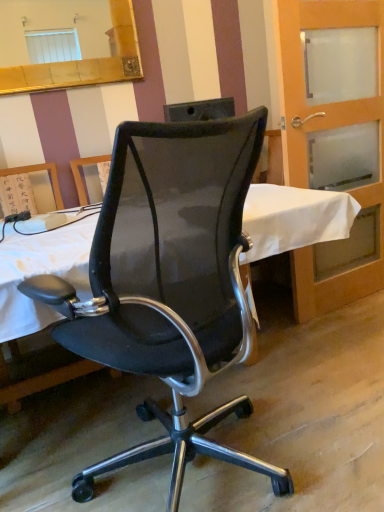
Measure the distance between point (370,83) and camera.

The depth of point (370,83) is 7.48 feet.

Describe the element at coordinates (334, 139) in the screenshot. I see `translucent glass door at right` at that location.

What do you see at coordinates (169, 282) in the screenshot?
I see `black mesh office chair at center` at bounding box center [169, 282].

The height and width of the screenshot is (512, 384). What are the coordinates of `translucent glass door at right` in the screenshot? It's located at (334, 139).

Is translucent glass door at right positioned far away from gold-framed mirror at upper left?

translucent glass door at right is positioned a significant distance from gold-framed mirror at upper left.

Considering the sizes of objects translucent glass door at right and gold-framed mirror at upper left in the image provided, who is smaller, translucent glass door at right or gold-framed mirror at upper left?

With smaller size is gold-framed mirror at upper left.

Is point (347, 281) behind point (62, 85)?

Yes, point (347, 281) is behind point (62, 85).

In the scene shown: Is translucent glass door at right wider or thinner than gold-framed mirror at upper left?

translucent glass door at right is wider than gold-framed mirror at upper left.

How far apart are translucent glass door at right and black mesh office chair at center?

They are 1.11 meters apart.

Can you confirm if translucent glass door at right is smaller than black mesh office chair at center?

Indeed, translucent glass door at right has a smaller size compared to black mesh office chair at center.

Is translucent glass door at right facing away from black mesh office chair at center?

That's not correct — translucent glass door at right is not looking away from black mesh office chair at center.

Which of these two, translucent glass door at right or black mesh office chair at center, is wider?

black mesh office chair at center is wider.

Is black mesh office chair at center touching translucent glass door at right?

No.

From a real-world perspective, is black mesh office chair at center below translucent glass door at right?

Yes.

Which of these two, black mesh office chair at center or translucent glass door at right, is wider?

black mesh office chair at center is wider.

The image size is (384, 512). What are the coordinates of `chair below the translucent glass door at right (from a real-world perspective)` in the screenshot? It's located at (169, 282).

How much distance is there between gold-framed mirror at upper left and black mesh office chair at center?

gold-framed mirror at upper left and black mesh office chair at center are 1.49 meters apart from each other.

Considering the sizes of objects gold-framed mirror at upper left and black mesh office chair at center in the image provided, who is taller, gold-framed mirror at upper left or black mesh office chair at center?

black mesh office chair at center is taller.

Considering the sizes of objects gold-framed mirror at upper left and black mesh office chair at center in the image provided, who is smaller, gold-framed mirror at upper left or black mesh office chair at center?

gold-framed mirror at upper left.

Identify the location of chair below the gold-framed mirror at upper left (from a real-world perspective). Image resolution: width=384 pixels, height=512 pixels. pyautogui.click(x=169, y=282).

Is gold-framed mirror at upper left surrounded by black mesh office chair at center?

No, black mesh office chair at center does not contain gold-framed mirror at upper left.

Considering the relative sizes of black mesh office chair at center and gold-framed mirror at upper left in the image provided, is black mesh office chair at center wider than gold-framed mirror at upper left?

Correct, the width of black mesh office chair at center exceeds that of gold-framed mirror at upper left.

Who is taller, black mesh office chair at center or gold-framed mirror at upper left?

With more height is black mesh office chair at center.

Which object is thinner, gold-framed mirror at upper left or translucent glass door at right?

With smaller width is gold-framed mirror at upper left.

In the scene shown: Is gold-framed mirror at upper left to the left of translucent glass door at right from the viewer's perspective?

Indeed, gold-framed mirror at upper left is positioned on the left side of translucent glass door at right.

In terms of height, does gold-framed mirror at upper left look taller or shorter compared to translucent glass door at right?

Clearly, gold-framed mirror at upper left is shorter compared to translucent glass door at right.

Where is `mirror located behind the translucent glass door at right`? The height and width of the screenshot is (512, 384). mirror located behind the translucent glass door at right is located at coordinates (83, 62).

I want to click on chair in front of the translucent glass door at right, so click(x=169, y=282).

Which object lies further to the anchor point translucent glass door at right, black mesh office chair at center or gold-framed mirror at upper left?

black mesh office chair at center.

Which object lies nearer to the anchor point black mesh office chair at center, translucent glass door at right or gold-framed mirror at upper left?

translucent glass door at right is positioned closer to the anchor black mesh office chair at center.

Which object lies nearer to the anchor point translucent glass door at right, gold-framed mirror at upper left or black mesh office chair at center?

gold-framed mirror at upper left lies closer to translucent glass door at right than the other object.

Estimate the real-world distances between objects in this image. Which object is closer to gold-framed mirror at upper left, translucent glass door at right or black mesh office chair at center?

translucent glass door at right lies closer to gold-framed mirror at upper left than the other object.

Estimate the real-world distances between objects in this image. Which object is closer to gold-framed mirror at upper left, black mesh office chair at center or translucent glass door at right?

Based on the image, translucent glass door at right appears to be nearer to gold-framed mirror at upper left.

Looking at this image, looking at the image, which one is located further to black mesh office chair at center, gold-framed mirror at upper left or translucent glass door at right?

gold-framed mirror at upper left lies further to black mesh office chair at center than the other object.

Where is `chair situated between gold-framed mirror at upper left and translucent glass door at right from left to right`? The width and height of the screenshot is (384, 512). chair situated between gold-framed mirror at upper left and translucent glass door at right from left to right is located at coordinates pos(169,282).